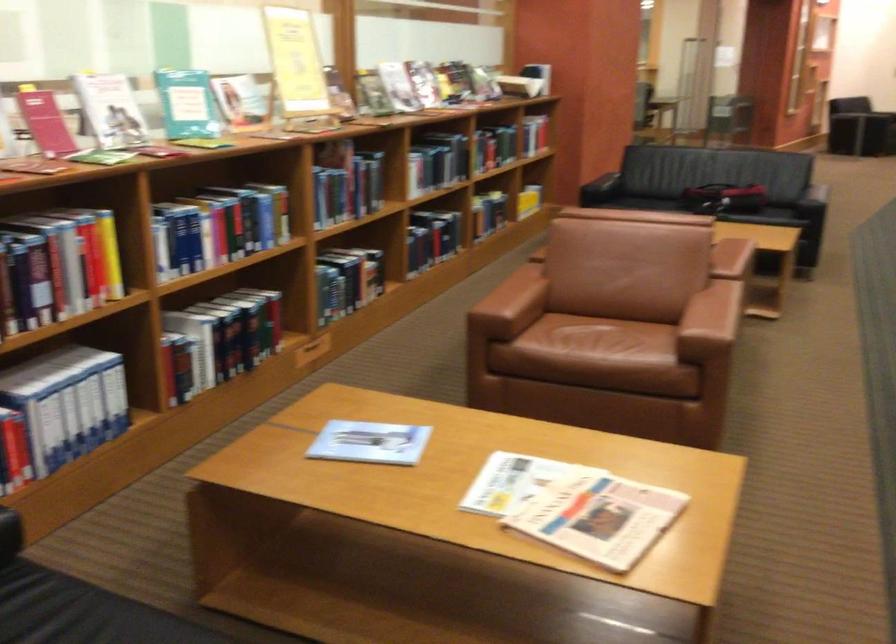
The width and height of the screenshot is (896, 644). Describe the element at coordinates (369, 442) in the screenshot. I see `a blue booklet` at that location.